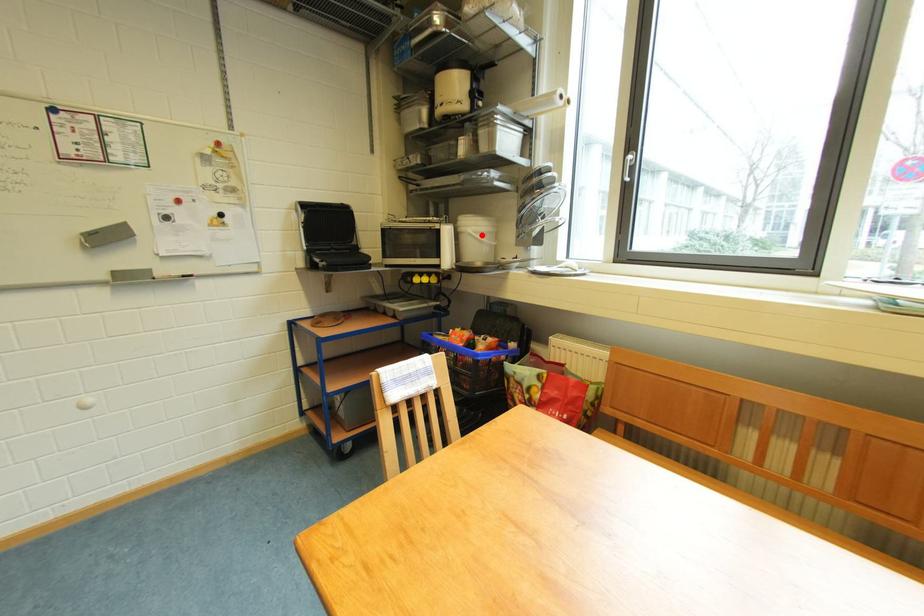
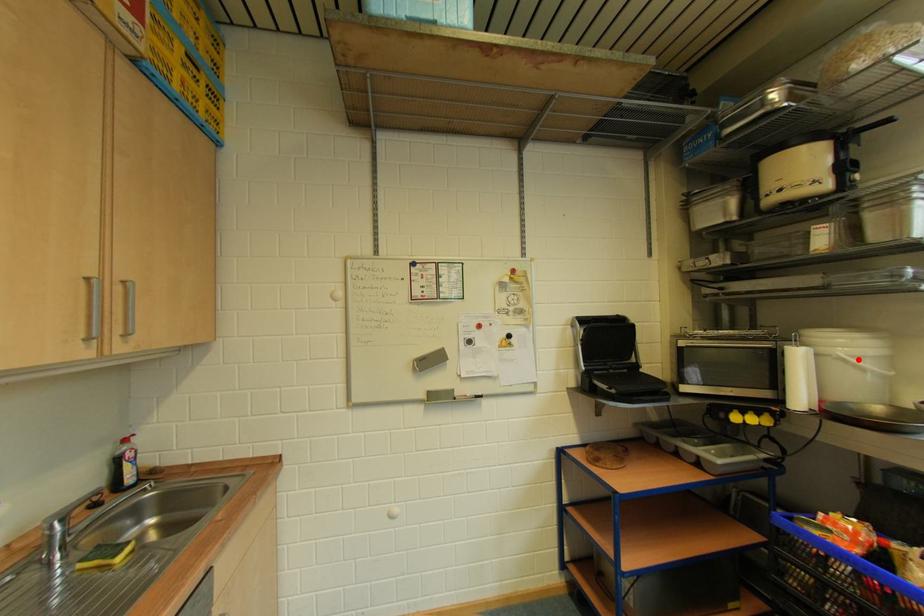
I am providing you with two images of the same scene from different viewpoints. A red point is marked on the first image and another point is marked on the second image. Do the highlighted points in image1 and image2 indicate the same real-world spot?

Yes